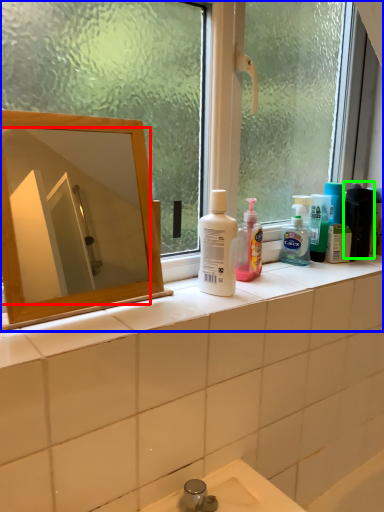
Question: Which object is the closest to the mirror (highlighted by a red box)? Choose among these: window (highlighted by a blue box) or toiletry (highlighted by a green box).

Choices:
 (A) window
 (B) toiletry

Answer: (A)